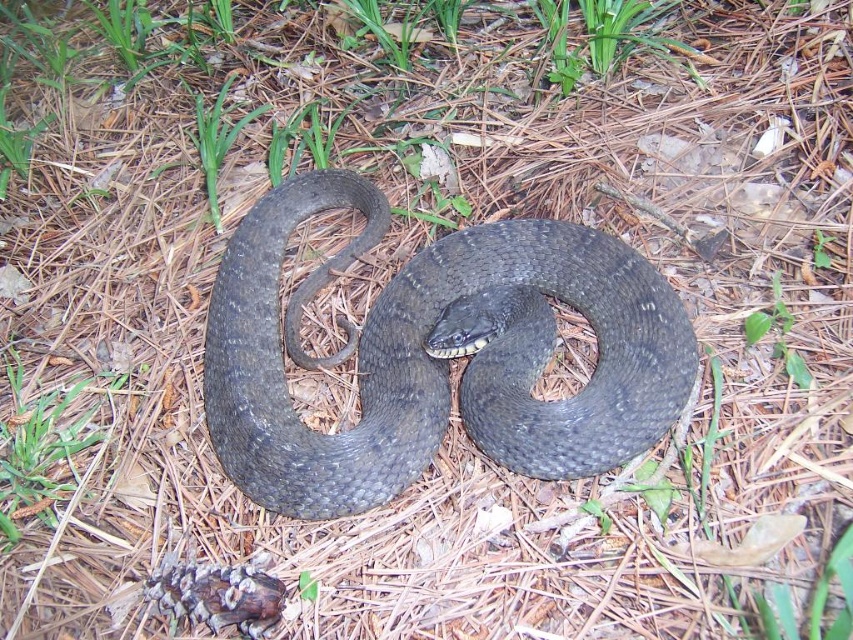
Can you confirm if shiny dark gray snake at center is smaller than green matte grass at lower left?

No.

At what (x,y) coordinates should I click in order to perform the action: click on shiny dark gray snake at center. Please return your answer as a coordinate pair (x, y). The width and height of the screenshot is (853, 640). Looking at the image, I should click on (438, 355).